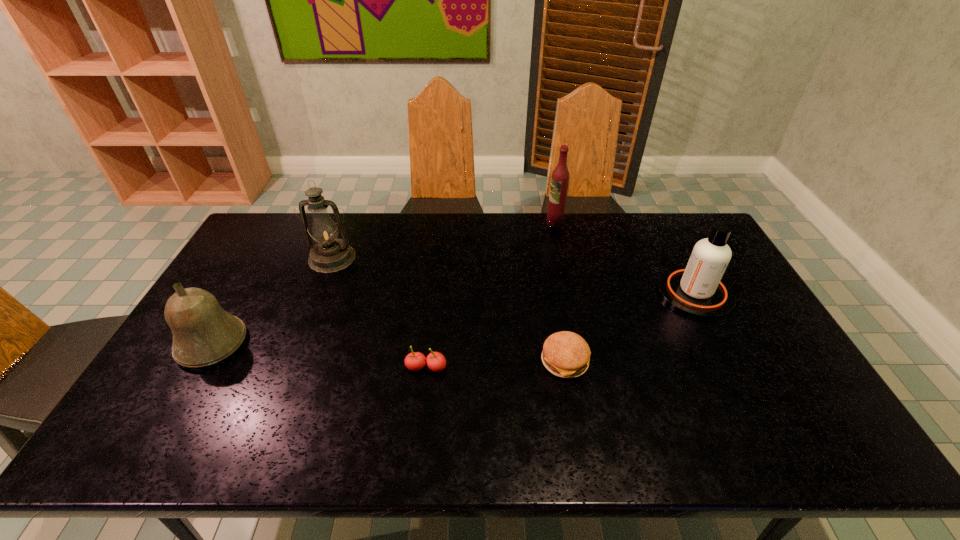
The image size is (960, 540). I want to click on liquor, so click(560, 177).

Find the location of `oil lamp`. oil lamp is located at coordinates (329, 255).

Locate an element on the screen. Image resolution: width=960 pixels, height=540 pixels. cleansing agent is located at coordinates (697, 290).

Identify the location of the leftmost object. (203, 333).

Where is `cherry`? The width and height of the screenshot is (960, 540). cherry is located at coordinates (415, 361).

Where is `hamburger`? Image resolution: width=960 pixels, height=540 pixels. hamburger is located at coordinates (565, 354).

The width and height of the screenshot is (960, 540). Find the location of `blank space located 0.060m on the label of the farthest object`. blank space located 0.060m on the label of the farthest object is located at coordinates (530, 223).

Locate an element on the screen. free space located on the label of the farthest object is located at coordinates (440, 223).

This screenshot has width=960, height=540. I want to click on vacant position located 0.260m on the label of the farthest object, so click(477, 223).

You are a GUI agent. You are given a task and a screenshot of the screen. Output one action in this format:
    pyautogui.click(x=<x>, y=<y>)
    Task: Click on the blank space located 0.360m on the front of the second object from left to right
    The height and width of the screenshot is (540, 960).
    Given the screenshot: What is the action you would take?
    pyautogui.click(x=292, y=362)